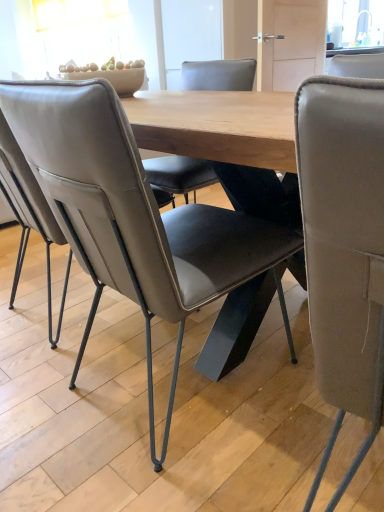
Question: Visually, is leather at center, positioned as the 1th chair in left-to-right order, positioned to the left or to the right of leather at right, the 2th chair when ordered from left to right?

Choices:
 (A) right
 (B) left

Answer: (B)

Question: From a real-world perspective, relative to leather at right, the 2th chair when ordered from left to right, is leather at center, positioned as the 1th chair in left-to-right order, vertically above or below?

Choices:
 (A) above
 (B) below

Answer: (A)

Question: Is point (238, 238) closer or farther from the camera than point (344, 327)?

Choices:
 (A) farther
 (B) closer

Answer: (A)

Question: Is leather at right, acting as the first chair starting from the right, bigger or smaller than leather at center, arranged as the second chair when viewed from the right?

Choices:
 (A) big
 (B) small

Answer: (B)

Question: From the image's perspective, is leather at right, the 2th chair when ordered from left to right, above or below leather at center, arranged as the second chair when viewed from the right?

Choices:
 (A) below
 (B) above

Answer: (A)

Question: Is leather at right, acting as the first chair starting from the right, in front of or behind leather at center, arranged as the second chair when viewed from the right, in the image?

Choices:
 (A) behind
 (B) front

Answer: (B)

Question: Is point pyautogui.click(x=334, y=246) closer or farther from the camera than point pyautogui.click(x=117, y=198)?

Choices:
 (A) closer
 (B) farther

Answer: (A)